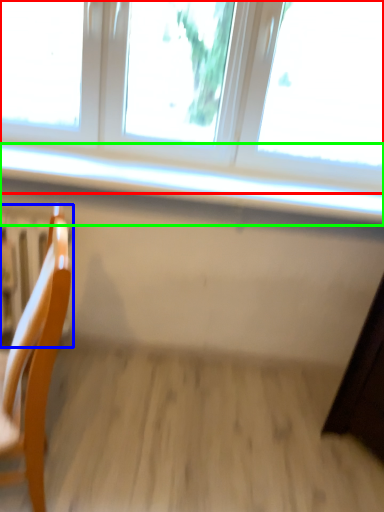
Question: Which is nearer to the window (highlighted by a red box)? radiator (highlighted by a blue box) or window sill (highlighted by a green box).

Choices:
 (A) radiator
 (B) window sill

Answer: (B)